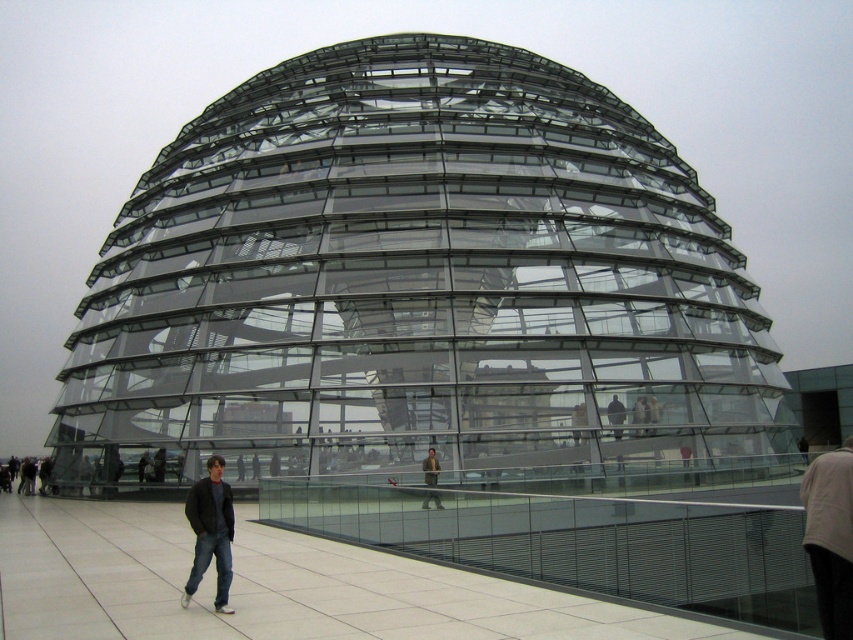
Is white cotton shirt at lower right shorter than dark gray fabric jacket at center?

No, white cotton shirt at lower right is not shorter than dark gray fabric jacket at center.

Who is lower down, white cotton shirt at lower right or dark gray fabric jacket at center?

Positioned lower is white cotton shirt at lower right.

Does point (840, 461) come behind point (621, 435)?

No.

Where is `white cotton shirt at lower right`? white cotton shirt at lower right is located at coordinates (830, 536).

Does transparent glass dome at center have a lesser height compared to white cotton shirt at lower right?

In fact, transparent glass dome at center may be taller than white cotton shirt at lower right.

Measure the distance between transparent glass dome at center and white cotton shirt at lower right.

transparent glass dome at center is 31.32 meters from white cotton shirt at lower right.

The height and width of the screenshot is (640, 853). What do you see at coordinates (416, 284) in the screenshot? I see `transparent glass dome at center` at bounding box center [416, 284].

Image resolution: width=853 pixels, height=640 pixels. What are the coordinates of `transparent glass dome at center` in the screenshot? It's located at (416, 284).

Can you confirm if white cotton shirt at lower right is bigger than dark blue jeans at lower left?

Yes, white cotton shirt at lower right is bigger than dark blue jeans at lower left.

Can you confirm if white cotton shirt at lower right is thinner than dark blue jeans at lower left?

In fact, white cotton shirt at lower right might be wider than dark blue jeans at lower left.

Between point (836, 616) and point (201, 515), which one is positioned behind?

Point (201, 515)

This screenshot has width=853, height=640. What are the coordinates of `white cotton shirt at lower right` in the screenshot? It's located at (830, 536).